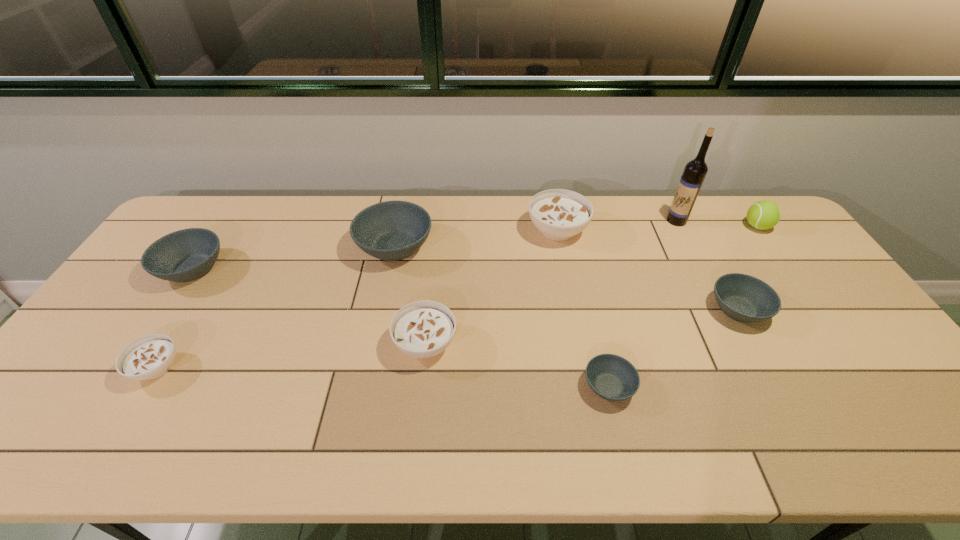
Locate which gray soup bowl ranks fourth in proximity to the tallest object. Please provide its 2D coordinates. Your answer should be formatted as a tuple, i.e. [(x, y)], where the tuple contains the x and y coordinates of a point satisfying the conditions above.

[(185, 255)]

This screenshot has height=540, width=960. In order to click on the third closest gray soup bowl relative to the green tennis ball in this screenshot , I will do `click(392, 230)`.

Identify the location of vacant space that satisfies the following two spatial constraints: 1. on the label of the tallest object; 2. on the front side of the smallest white soup bowl. This screenshot has width=960, height=540. (752, 368).

You are a GUI agent. You are given a task and a screenshot of the screen. Output one action in this format:
    pyautogui.click(x=<x>, y=<y>)
    Task: Click on the free space that satisfies the following two spatial constraints: 1. on the back side of the second gray soup bowl from left to right; 2. on the right side of the biggest white soup bowl
    The image size is (960, 540).
    Given the screenshot: What is the action you would take?
    pyautogui.click(x=398, y=231)

Identify the location of free space that satisfies the following two spatial constraints: 1. on the back side of the leftmost white soup bowl; 2. on the right side of the tennis ball. (243, 226).

At what (x,y) coordinates should I click in order to perform the action: click on vacant region that satisfies the following two spatial constraints: 1. on the label of the wine bottle; 2. on the right side of the rightmost object. Please return your answer as a coordinate pair (x, y). The width and height of the screenshot is (960, 540). Looking at the image, I should click on (680, 226).

Locate an element on the screen. vacant space that satisfies the following two spatial constraints: 1. on the label of the black wine bottle; 2. on the right side of the rightmost soup bowl is located at coordinates (722, 309).

Find the location of a particular element. Image resolution: width=960 pixels, height=540 pixels. free spot that satisfies the following two spatial constraints: 1. on the back side of the rightmost object; 2. on the right side of the biggest gray soup bowl is located at coordinates (399, 226).

Locate an element on the screen. This screenshot has width=960, height=540. vacant space that satisfies the following two spatial constraints: 1. on the back side of the rightmost soup bowl; 2. on the label of the tallest object is located at coordinates (690, 221).